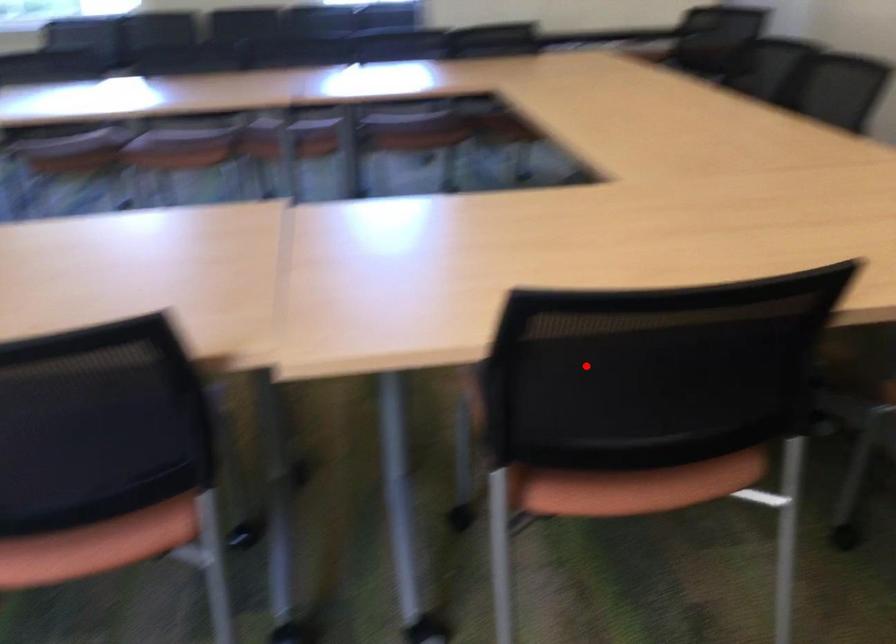
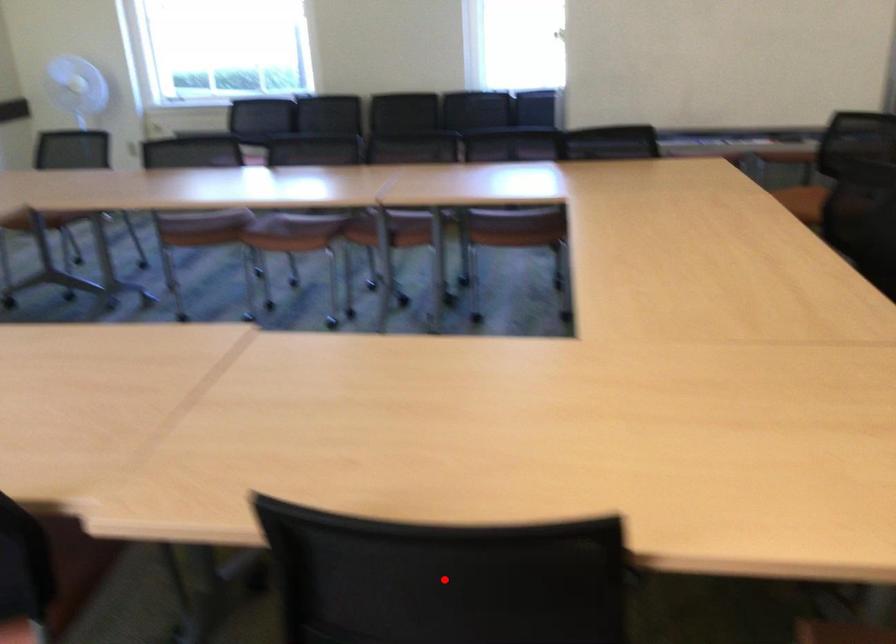
I am providing you with two images of the same scene from different viewpoints. A red point is marked on the first image and another point is marked on the second image. Is the red point in image1 aligned with the point shown in image2?

Yes